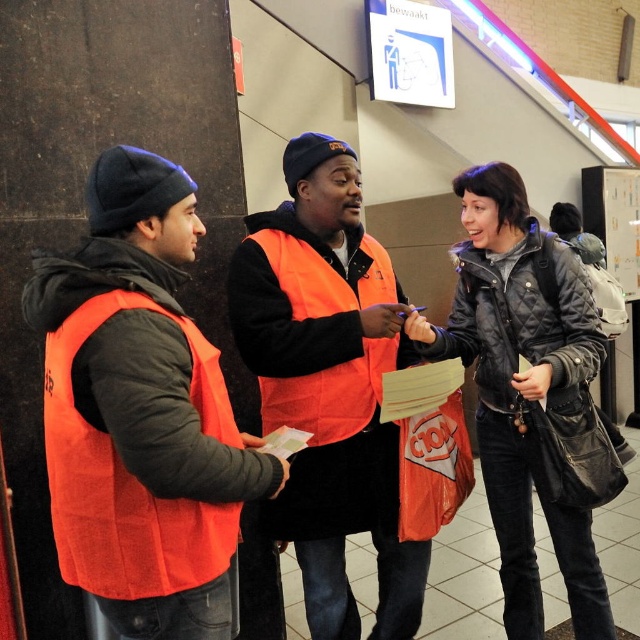
Question: Which object is the closest to the quilted black jacket at right?

Choices:
 (A) orange vest at center
 (B) matte orange vest at left
 (C) orange fabric safety vest at center

Answer: (C)

Question: Where is orange vest at center located in relation to orange fabric safety vest at left in the image?

Choices:
 (A) below
 (B) above

Answer: (A)

Question: Considering the real-world distances, which object is closest to the orange fabric safety vest at left?

Choices:
 (A) orange fabric safety vest at center
 (B) orange vest at center
 (C) matte orange vest at left

Answer: (C)

Question: Is orange fabric safety vest at left to the left of orange fabric safety vest at center from the viewer's perspective?

Choices:
 (A) no
 (B) yes

Answer: (B)

Question: Which of the following is the farthest from the observer?

Choices:
 (A) (317, 396)
 (B) (192, 442)

Answer: (A)

Question: Does orange fabric safety vest at left appear on the left side of orange fabric safety vest at center?

Choices:
 (A) no
 (B) yes

Answer: (B)